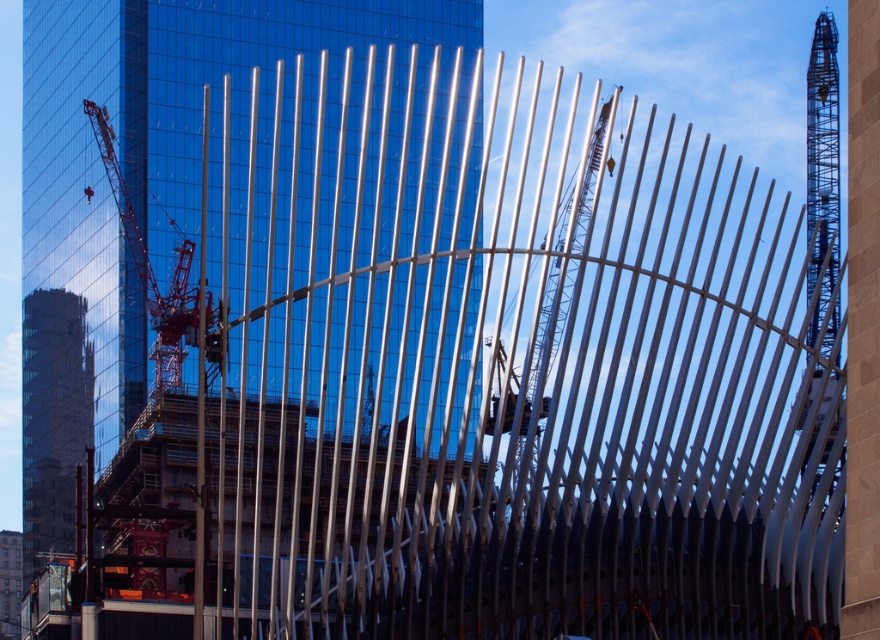
You are a construction worker standing at the base of the metallic silver crane at center. You need to move to the glass building in the background. Which direction should you face to walk directly toward the glass building?

You should face the direction opposite the metallic silver crane at center to walk directly toward the glass building in the background.